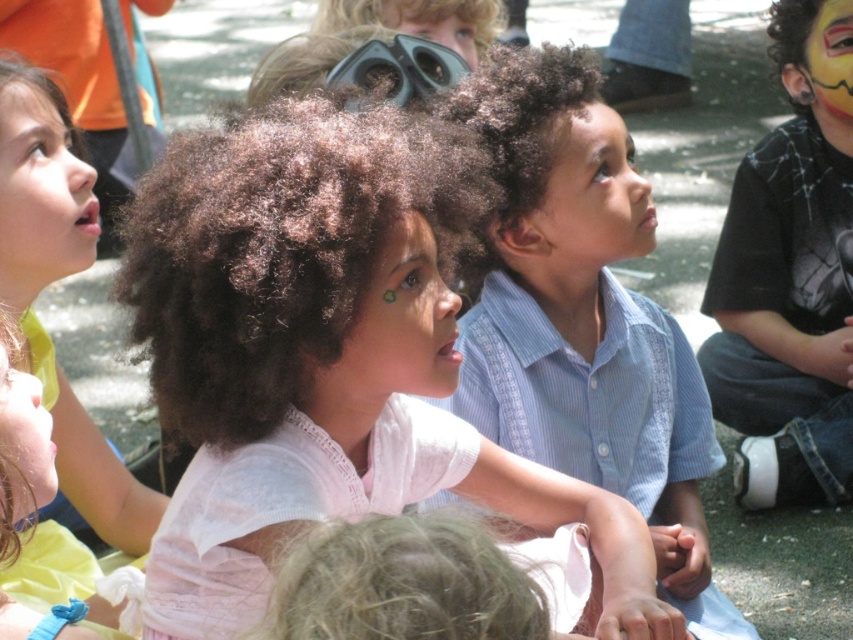
Is black matte shirt at right below black rubber goggles at upper center?

Yes.

Is black matte shirt at right above black rubber goggles at upper center?

No.

Locate an element on the screen. The image size is (853, 640). black matte shirt at right is located at coordinates (790, 276).

The height and width of the screenshot is (640, 853). Identify the location of black matte shirt at right. (790, 276).

What do you see at coordinates (325, 356) in the screenshot? This screenshot has height=640, width=853. I see `white matte shirt at center` at bounding box center [325, 356].

Can you confirm if white matte shirt at center is positioned to the left of smooth green face at lower left?

No, white matte shirt at center is not to the left of smooth green face at lower left.

Does point (374, 209) come in front of point (9, 486)?

No, (374, 209) is further to viewer.

Identify the location of white matte shirt at center. (325, 356).

Consider the image. Who is higher up, white matte shirt at center or matte white face at upper left?

matte white face at upper left is above.

Does white matte shirt at center appear on the right side of matte white face at upper left?

Correct, you'll find white matte shirt at center to the right of matte white face at upper left.

Which is in front, point (447, 419) or point (62, 182)?

Point (447, 419)

Image resolution: width=853 pixels, height=640 pixels. What are the coordinates of `white matte shirt at center` in the screenshot? It's located at (325, 356).